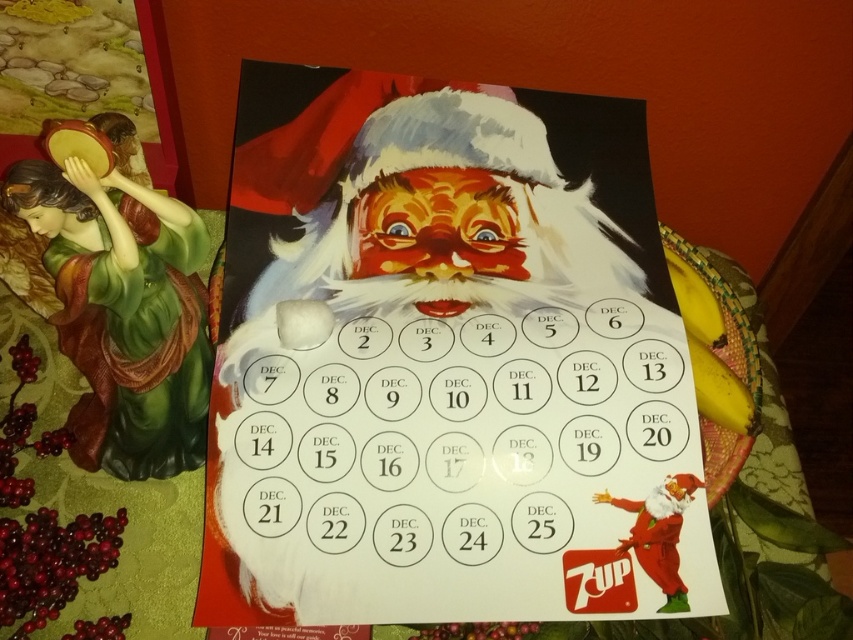
Question: Does matte paper calendar at center have a smaller size compared to green glossy statue at left?

Choices:
 (A) yes
 (B) no

Answer: (B)

Question: Based on their relative distances, which object is farther from the matte paper calendar at center?

Choices:
 (A) shiny red santa at center
 (B) red velvet santa at lower right
 (C) green glossy statue at left

Answer: (B)

Question: Which of the following is the closest to the observer?

Choices:
 (A) shiny red santa at center
 (B) green glossy statue at left

Answer: (B)

Question: Which point is farther to the camera?

Choices:
 (A) (538, 518)
 (B) (529, 195)
 (C) (654, 576)

Answer: (B)

Question: Is matte paper calendar at center below green glossy statue at left?

Choices:
 (A) yes
 (B) no

Answer: (A)

Question: Is shiny red santa at center thinner than red velvet santa at lower right?

Choices:
 (A) yes
 (B) no

Answer: (B)